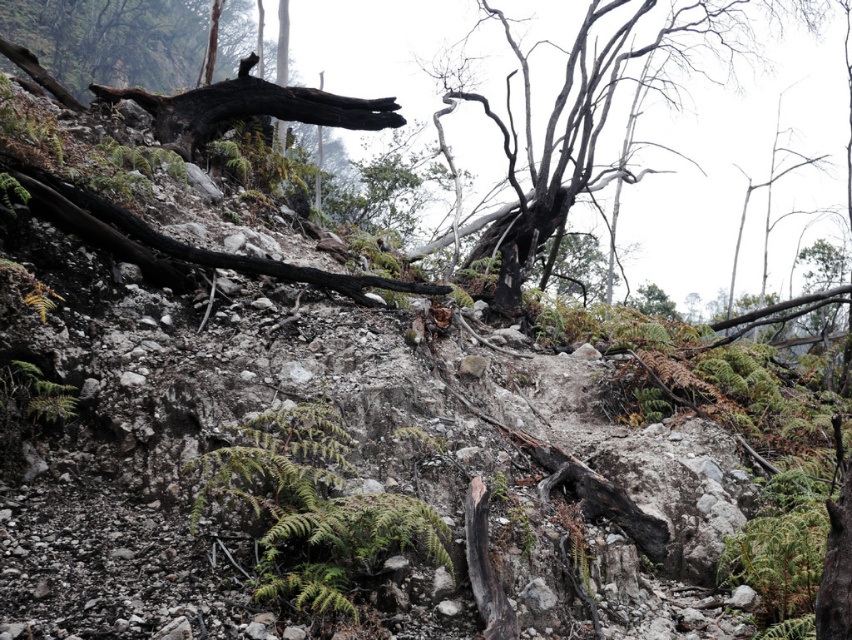
You are hiking through this rugged landscape and want to take a photo of both the green fuzzy fern at center and the charcoal textured tree at center. Which object should you focus on first to ensure both are in clear view?

You should focus on the green fuzzy fern at center first since it is closer to you than the charcoal textured tree at center. By focusing on the closer object, the tree will still be in focus due to the depth of field, ensuring both are clear.

You are standing at the base of the large charred tree trunk and want to place two markers at the coordinates point (243, 442) and point (596, 189). Which marker will be closer to your current position?

Point (243, 442) is closer to the camera than point (596, 189), so the marker at point (243, 442) will be closer to your current position.